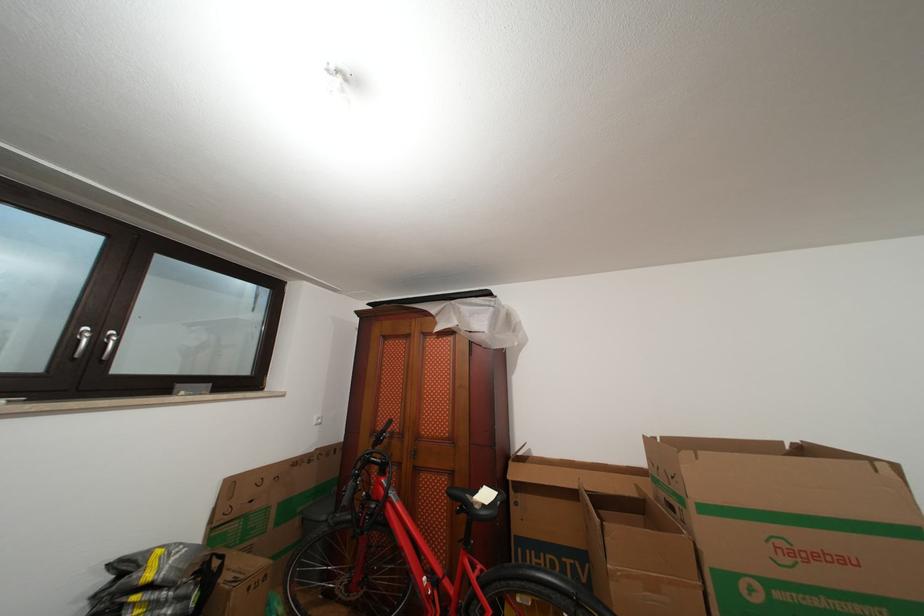
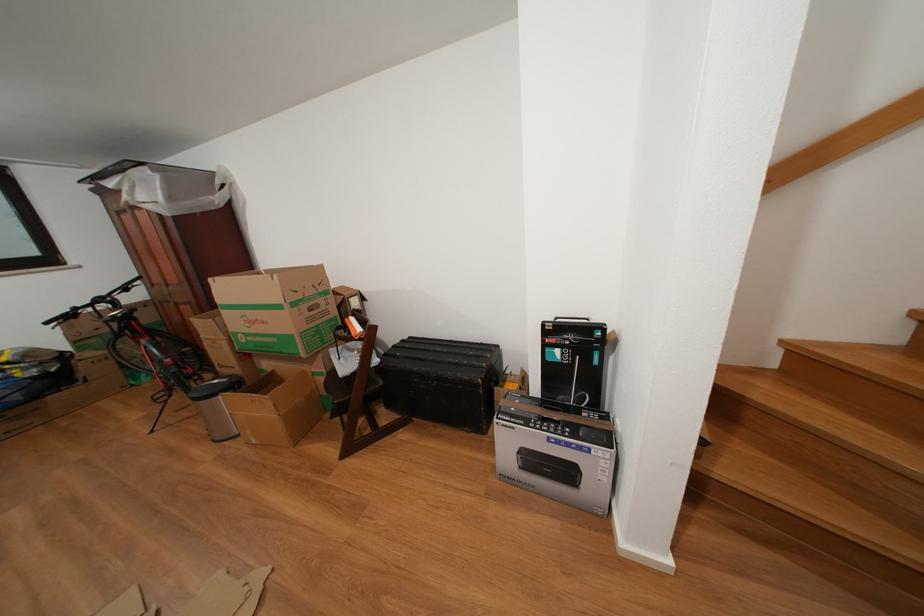
In the second image, find the point that corresponds to point (853, 565) in the first image.

(272, 328)